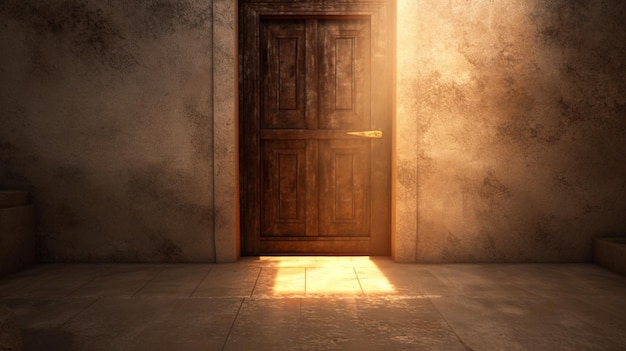
Image resolution: width=626 pixels, height=351 pixels. In order to click on wall in this screenshot , I will do `click(126, 102)`, `click(500, 127)`.